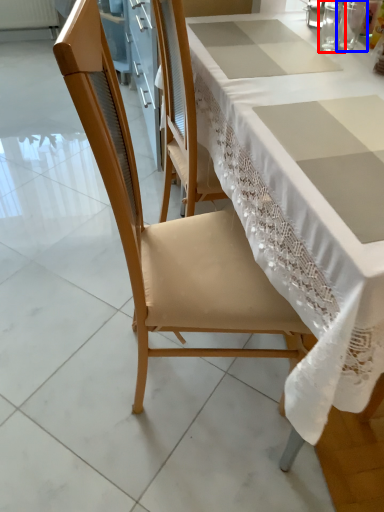
Question: Which object appears farthest to the camera in this image, tableware (highlighted by a red box) or tableware (highlighted by a blue box)?

Choices:
 (A) tableware
 (B) tableware

Answer: (B)